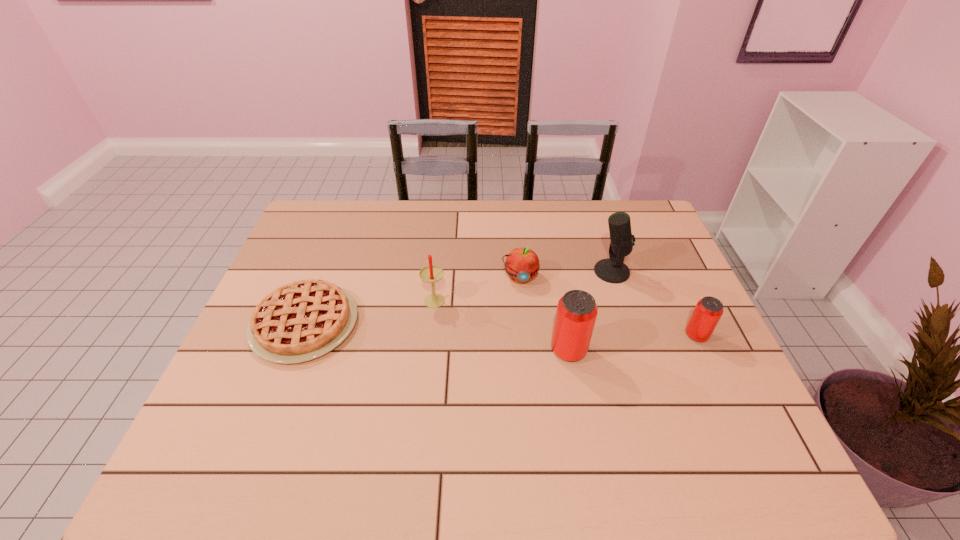
Where is `free space between the fourth object from left to right and the rightmost object`? free space between the fourth object from left to right and the rightmost object is located at coordinates (633, 343).

What are the coordinates of `vacant space in between the apple and the taller can` in the screenshot? It's located at (544, 314).

In order to click on free space between the microphone and the candle in this screenshot , I will do `click(523, 285)`.

Locate an element on the screen. The height and width of the screenshot is (540, 960). object that can be found as the third closest to the pie is located at coordinates (576, 314).

Choose which object is the second nearest neighbor to the third object from left to right. Please provide its 2D coordinates. Your answer should be formatted as a tuple, i.e. [(x, y)], where the tuple contains the x and y coordinates of a point satisfying the conditions above.

[(612, 270)]

Where is `free region that satisfies the following two spatial constraints: 1. on the back side of the candle; 2. on the right side of the microphone`? The height and width of the screenshot is (540, 960). free region that satisfies the following two spatial constraints: 1. on the back side of the candle; 2. on the right side of the microphone is located at coordinates (437, 272).

Identify the location of vacant space that satisfies the following two spatial constraints: 1. on the back side of the second object from left to right; 2. on the right side of the fourth object from right to left. The height and width of the screenshot is (540, 960). (437, 277).